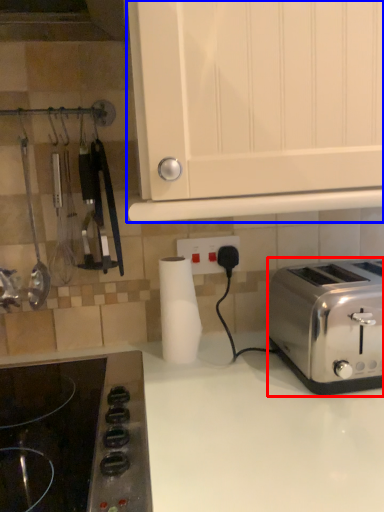
Question: Which object appears farthest to the camera in this image, toaster (highlighted by a red box) or cabinetry (highlighted by a blue box)?

Choices:
 (A) toaster
 (B) cabinetry

Answer: (A)